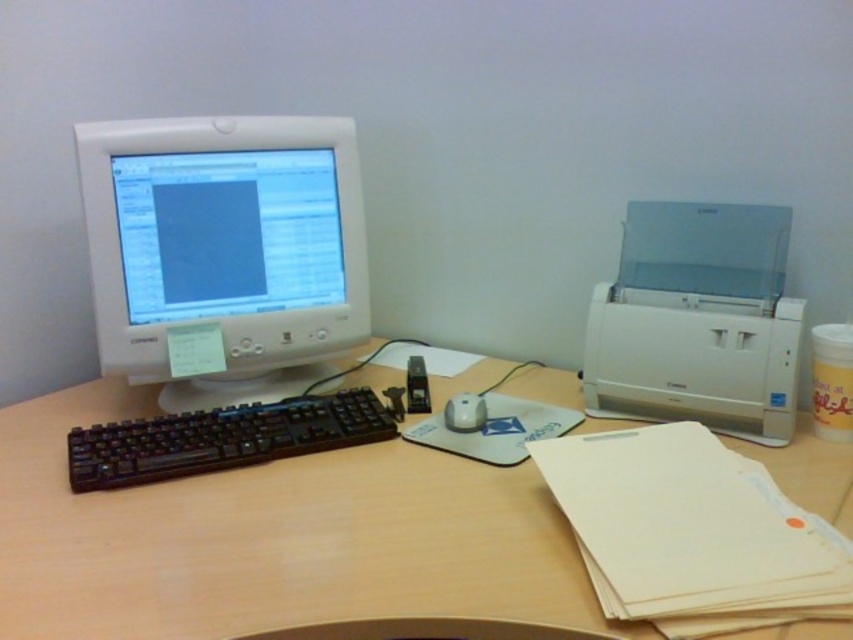
Question: Is white glossy monitor at upper left thinner than black plastic keyboard at left?

Choices:
 (A) no
 (B) yes

Answer: (B)

Question: Which object is closer to the camera taking this photo?

Choices:
 (A) wooden at center
 (B) black plastic keyboard at left

Answer: (A)

Question: Is white glossy computer monitor at upper left wider than black plastic keyboard at left?

Choices:
 (A) yes
 (B) no

Answer: (B)

Question: Among these objects, which one is farthest from the camera?

Choices:
 (A) wooden at center
 (B) white glossy computer monitor at upper left

Answer: (B)

Question: Which object appears farthest from the camera in this image?

Choices:
 (A) wooden at center
 (B) white glossy mouse at center

Answer: (B)

Question: Is wooden at center bigger than black plastic keyboard at left?

Choices:
 (A) no
 (B) yes

Answer: (B)